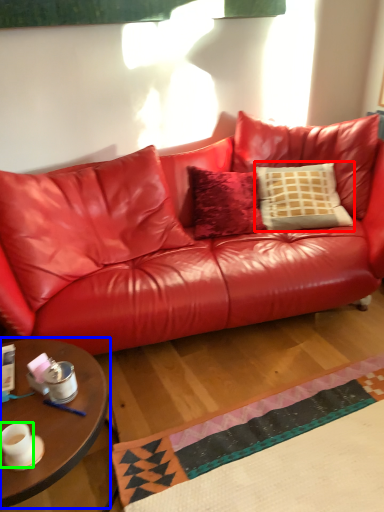
Question: Estimate the real-world distances between objects in this image. Which object is closer to pillow (highlighted by a red box), coffee table (highlighted by a blue box) or coffee cup (highlighted by a green box)?

Choices:
 (A) coffee table
 (B) coffee cup

Answer: (A)